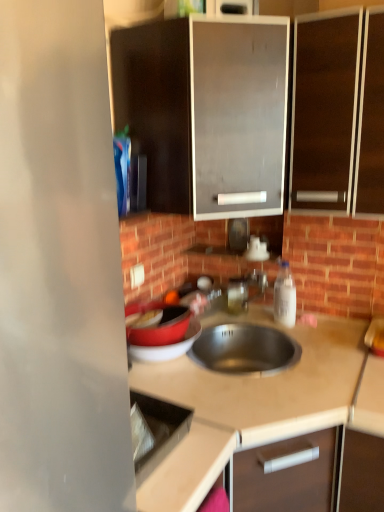
You are a GUI agent. You are given a task and a screenshot of the screen. Output one action in this format:
    pyautogui.click(x=<x>, y=<y>)
    Task: Click on the matte black cabinet at upper center, the second cabinetry from the right
    
    Given the screenshot: What is the action you would take?
    pyautogui.click(x=203, y=108)

In order to face dark wood cabinet at upper right, the second cabinetry viewed from the left, should I rotate leftwards or rightwards?

A 20.250 degree turn to the right will do.

Find the location of a particular element. The image size is (384, 512). white plastic electric outlet at upper center is located at coordinates (137, 275).

Considering the relative sizes of matte black cabinet at upper center, the second cabinetry from the right, and dark wood cabinet at upper right, the second cabinetry viewed from the left, in the image provided, is matte black cabinet at upper center, the second cabinetry from the right, wider than dark wood cabinet at upper right, the second cabinetry viewed from the left,?

Yes, matte black cabinet at upper center, the second cabinetry from the right, is wider than dark wood cabinet at upper right, the second cabinetry viewed from the left.

Are matte black cabinet at upper center, the second cabinetry from the right, and dark wood cabinet at upper right, the second cabinetry viewed from the left, making contact?

No.

Is matte black cabinet at upper center, the second cabinetry from the right, bigger than dark wood cabinet at upper right, the first cabinetry from the right?

Indeed, matte black cabinet at upper center, the second cabinetry from the right, has a larger size compared to dark wood cabinet at upper right, the first cabinetry from the right.

Would you say matte black cabinet at upper center, the second cabinetry from the right, is inside or outside dark wood cabinet at upper right, the second cabinetry viewed from the left?

The correct answer is: outside.

Image resolution: width=384 pixels, height=512 pixels. I want to click on bottle below the matte black cabinet at upper center, which is the 1th cabinetry in left-to-right order (from a real-world perspective), so click(x=285, y=296).

From a real-world perspective, is white plastic bottle at right on top of matte black cabinet at upper center, the second cabinetry from the right?

No, from a real-world perspective, white plastic bottle at right is not over matte black cabinet at upper center, the second cabinetry from the right

Is white plastic bottle at right shorter than matte black cabinet at upper center, which is the 1th cabinetry in left-to-right order?

Yes, white plastic bottle at right is shorter than matte black cabinet at upper center, which is the 1th cabinetry in left-to-right order.

Is matte black cabinet at upper center, the second cabinetry from the right, inside the boundaries of beige laminate countertop at center, or outside?

matte black cabinet at upper center, the second cabinetry from the right, exists outside the volume of beige laminate countertop at center.

From the image's perspective, who appears lower, matte black cabinet at upper center, the second cabinetry from the right, or beige laminate countertop at center?

From the image's view, beige laminate countertop at center is below.

Is matte black cabinet at upper center, the second cabinetry from the right, wider or thinner than beige laminate countertop at center?

In the image, matte black cabinet at upper center, the second cabinetry from the right, appears to be more narrow than beige laminate countertop at center.

Which of these two, white plastic electric outlet at upper center or dark wood cabinet at upper right, the first cabinetry from the right, is thinner?

With smaller width is white plastic electric outlet at upper center.

Considering the relative sizes of white plastic electric outlet at upper center and dark wood cabinet at upper right, the second cabinetry viewed from the left, in the image provided, is white plastic electric outlet at upper center bigger than dark wood cabinet at upper right, the second cabinetry viewed from the left,?

No.

Does point (134, 269) appear closer or farther from the camera than point (321, 157)?

Point (134, 269) is positioned farther from the camera compared to point (321, 157).

Which object is closer to the camera, white plastic electric outlet at upper center or dark wood cabinet at upper right, the first cabinetry from the right?

dark wood cabinet at upper right, the first cabinetry from the right, is more forward.

Relative to white plastic electric outlet at upper center, is dark wood cabinet at upper right, the first cabinetry from the right, in front or behind?

Clearly, dark wood cabinet at upper right, the first cabinetry from the right, is in front of white plastic electric outlet at upper center.

In the scene shown: Is white plastic electric outlet at upper center at the back of dark wood cabinet at upper right, the first cabinetry from the right?

That's not correct — dark wood cabinet at upper right, the first cabinetry from the right, is not looking away from white plastic electric outlet at upper center.

What are the coordinates of `electric outlet that is behind the dark wood cabinet at upper right, the second cabinetry viewed from the left` in the screenshot? It's located at (137, 275).

Is matte black cabinet at upper center, the second cabinetry from the right, turned away from white plastic electric outlet at upper center?

That's not correct — matte black cabinet at upper center, the second cabinetry from the right, is not looking away from white plastic electric outlet at upper center.

Which is more to the right, matte black cabinet at upper center, which is the 1th cabinetry in left-to-right order, or white plastic electric outlet at upper center?

matte black cabinet at upper center, which is the 1th cabinetry in left-to-right order.

Is white plastic electric outlet at upper center surrounded by matte black cabinet at upper center, the second cabinetry from the right?

No, white plastic electric outlet at upper center is not inside matte black cabinet at upper center, the second cabinetry from the right.

Which is closer, (252, 80) or (136, 277)?

The point (252, 80) is closer to the camera.

Is beige laminate countertop at center touching dark wood cabinet at upper right, the first cabinetry from the right?

beige laminate countertop at center and dark wood cabinet at upper right, the first cabinetry from the right, are clearly separated.

Is beige laminate countertop at center closer to the viewer compared to dark wood cabinet at upper right, the first cabinetry from the right?

Yes, it is.

Is beige laminate countertop at center wider than dark wood cabinet at upper right, the second cabinetry viewed from the left?

Yes.

Considering the positions of objects beige laminate countertop at center and dark wood cabinet at upper right, the second cabinetry viewed from the left, in the image provided, who is more to the left, beige laminate countertop at center or dark wood cabinet at upper right, the second cabinetry viewed from the left,?

beige laminate countertop at center.

Image resolution: width=384 pixels, height=512 pixels. What are the coordinates of `cabinetry above the dark wood cabinet at upper right, the first cabinetry from the right (from the image's perspective)` in the screenshot? It's located at (203, 108).

Identify the location of cabinetry on the left side of white plastic bottle at right. click(203, 108).

Which object lies further to the anchor point white plastic electric outlet at upper center, beige laminate countertop at center or matte black cabinet at upper center, which is the 1th cabinetry in left-to-right order?

Based on the image, beige laminate countertop at center appears to be further to white plastic electric outlet at upper center.

From the image, which object appears to be nearer to white plastic bottle at right, white plastic electric outlet at upper center or matte black cabinet at upper center, which is the 1th cabinetry in left-to-right order?

white plastic electric outlet at upper center is closer to white plastic bottle at right.

Estimate the real-world distances between objects in this image. Which object is further from matte black cabinet at upper center, which is the 1th cabinetry in left-to-right order, white plastic bottle at right or beige laminate countertop at center?

The object further to matte black cabinet at upper center, which is the 1th cabinetry in left-to-right order, is beige laminate countertop at center.

Which object lies nearer to the anchor point matte black cabinet at upper center, the second cabinetry from the right, dark wood cabinet at upper right, the first cabinetry from the right, or white plastic electric outlet at upper center?

dark wood cabinet at upper right, the first cabinetry from the right, is closer to matte black cabinet at upper center, the second cabinetry from the right.

Based on their spatial positions, is white plastic bottle at right or white plastic electric outlet at upper center closer to dark wood cabinet at upper right, the second cabinetry viewed from the left?

The object closer to dark wood cabinet at upper right, the second cabinetry viewed from the left, is white plastic bottle at right.

Looking at the image, which one is located further to dark wood cabinet at upper right, the second cabinetry viewed from the left, white plastic electric outlet at upper center or white plastic bottle at right?

The object further to dark wood cabinet at upper right, the second cabinetry viewed from the left, is white plastic electric outlet at upper center.

In the scene shown: Which object lies further to the anchor point matte black cabinet at upper center, the second cabinetry from the right, white plastic electric outlet at upper center or white plastic bottle at right?

The object further to matte black cabinet at upper center, the second cabinetry from the right, is white plastic bottle at right.

Estimate the real-world distances between objects in this image. Which object is closer to white plastic bottle at right, beige laminate countertop at center or white plastic electric outlet at upper center?

Based on the image, beige laminate countertop at center appears to be nearer to white plastic bottle at right.

Image resolution: width=384 pixels, height=512 pixels. I want to click on cabinetry between matte black cabinet at upper center, which is the 1th cabinetry in left-to-right order, and white plastic bottle at right, in the vertical direction, so click(324, 111).

Image resolution: width=384 pixels, height=512 pixels. I want to click on bottle between dark wood cabinet at upper right, the second cabinetry viewed from the left, and beige laminate countertop at center vertically, so [x=285, y=296].

Identify the location of electric outlet located between beige laminate countertop at center and white plastic bottle at right in the depth direction. The width and height of the screenshot is (384, 512). (137, 275).

This screenshot has height=512, width=384. I want to click on electric outlet between matte black cabinet at upper center, which is the 1th cabinetry in left-to-right order, and beige laminate countertop at center from top to bottom, so (x=137, y=275).